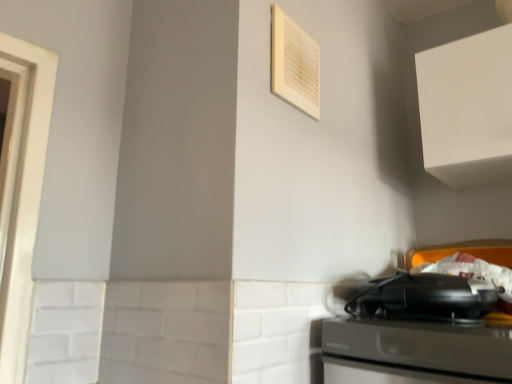
Question: From the image's perspective, is white matte cabinet at upper right below white plastic air conditioner at upper center?

Choices:
 (A) no
 (B) yes

Answer: (B)

Question: Is white plastic air conditioner at upper center at the back of white matte cabinet at upper right?

Choices:
 (A) yes
 (B) no

Answer: (B)

Question: From a real-world perspective, is white matte cabinet at upper right located beneath white plastic air conditioner at upper center?

Choices:
 (A) no
 (B) yes

Answer: (A)

Question: Is white plastic air conditioner at upper center completely or partially inside white matte cabinet at upper right?

Choices:
 (A) yes
 (B) no

Answer: (B)

Question: Is white matte cabinet at upper right far from white plastic air conditioner at upper center?

Choices:
 (A) no
 (B) yes

Answer: (A)

Question: Considering the positions of black plastic toaster at lower right and white plastic air conditioner at upper center in the image, is black plastic toaster at lower right wider or thinner than white plastic air conditioner at upper center?

Choices:
 (A) thin
 (B) wide

Answer: (B)

Question: From a real-world perspective, is black plastic toaster at lower right above or below white plastic air conditioner at upper center?

Choices:
 (A) below
 (B) above

Answer: (A)

Question: In the image, is black plastic toaster at lower right on the left side or the right side of white plastic air conditioner at upper center?

Choices:
 (A) right
 (B) left

Answer: (A)

Question: Is point (440, 316) positioned closer to the camera than point (297, 57)?

Choices:
 (A) closer
 (B) farther

Answer: (A)

Question: In terms of width, does white matte cabinet at upper right look wider or thinner when compared to black plastic toaster at lower right?

Choices:
 (A) wide
 (B) thin

Answer: (A)

Question: From a real-world perspective, is white matte cabinet at upper right positioned above or below black plastic toaster at lower right?

Choices:
 (A) above
 (B) below

Answer: (A)

Question: Is white matte cabinet at upper right inside or outside of black plastic toaster at lower right?

Choices:
 (A) outside
 (B) inside

Answer: (A)

Question: Considering the relative positions of white matte cabinet at upper right and black plastic toaster at lower right in the image provided, is white matte cabinet at upper right to the left or to the right of black plastic toaster at lower right?

Choices:
 (A) left
 (B) right

Answer: (B)

Question: Do you think white plastic air conditioner at upper center is within white matte cabinet at upper right, or outside of it?

Choices:
 (A) inside
 (B) outside

Answer: (B)

Question: Is point (305, 56) positioned closer to the camera than point (437, 152)?

Choices:
 (A) farther
 (B) closer

Answer: (B)